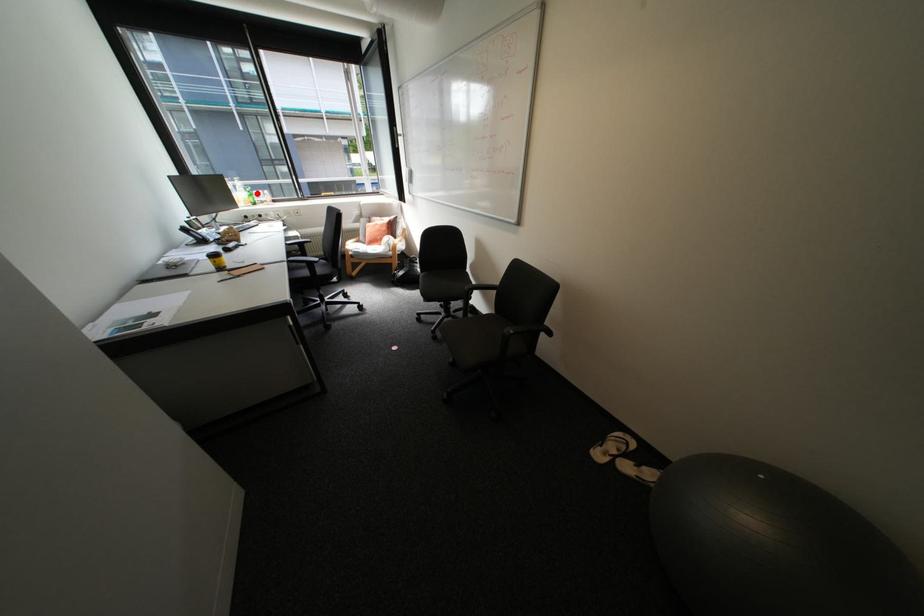
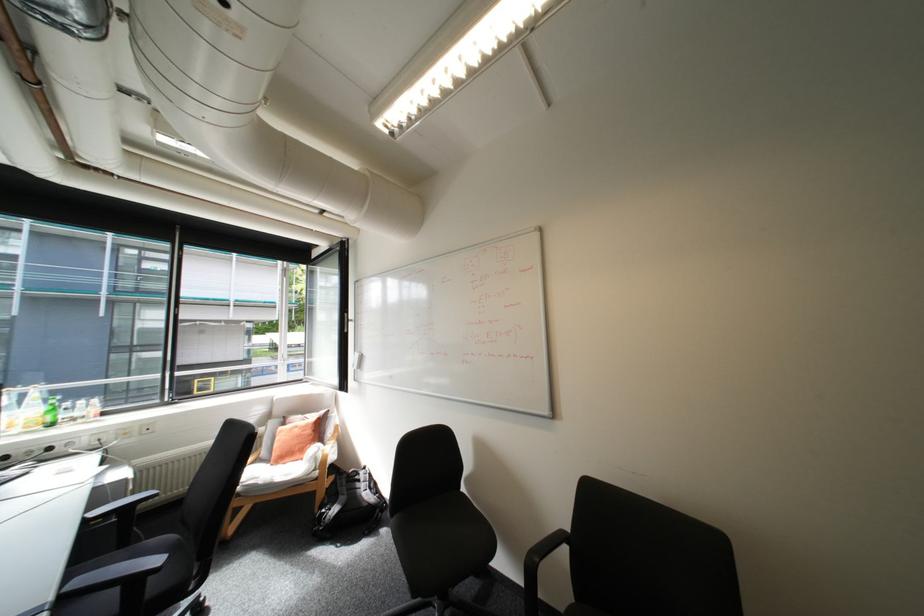
Where in the second image is the point corresponding to the highlighted location from the first image?

(55, 408)